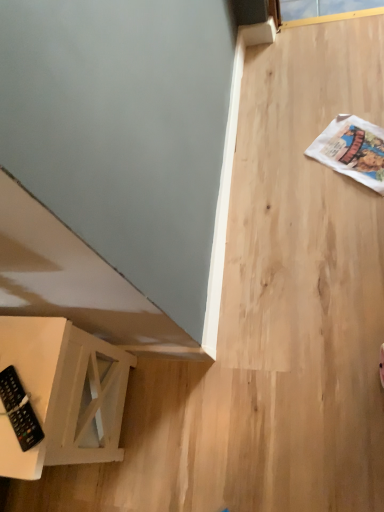
Question: From a real-world perspective, is black plastic remote at lower left positioned above or below white wood side table at lower left?

Choices:
 (A) above
 (B) below

Answer: (A)

Question: In the image, is black plastic remote at lower left on the left side or the right side of white wood side table at lower left?

Choices:
 (A) left
 (B) right

Answer: (B)

Question: Is point (1, 394) positioned closer to the camera than point (135, 364)?

Choices:
 (A) farther
 (B) closer

Answer: (B)

Question: From the image's perspective, is white wood side table at lower left above or below black plastic remote at lower left?

Choices:
 (A) below
 (B) above

Answer: (A)

Question: In the image, is white wood side table at lower left positioned in front of or behind black plastic remote at lower left?

Choices:
 (A) behind
 (B) front

Answer: (B)

Question: Do you think white wood side table at lower left is within black plastic remote at lower left, or outside of it?

Choices:
 (A) inside
 (B) outside

Answer: (B)

Question: Visually, is white wood side table at lower left positioned to the left or to the right of black plastic remote at lower left?

Choices:
 (A) left
 (B) right

Answer: (A)